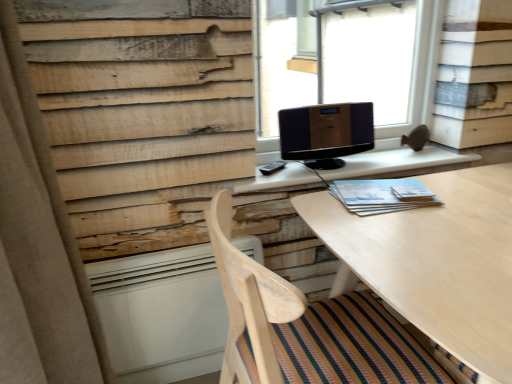
What are the coordinates of `vacant area that lies in front of light blue paper at right` in the screenshot? It's located at (408, 234).